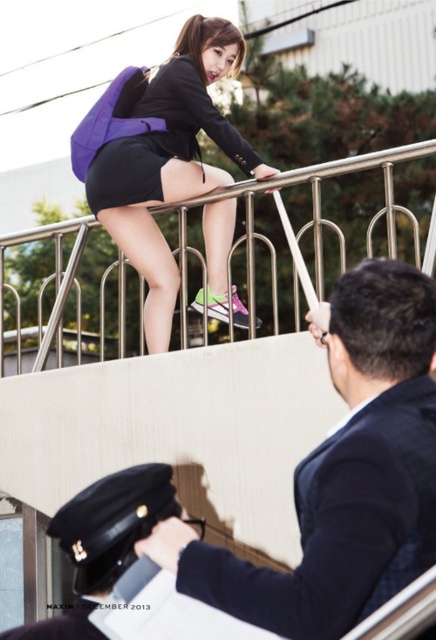
Who is higher up, dark blue suit at upper right or matte purple backpack at upper center?

matte purple backpack at upper center

Which is behind, point (405, 566) or point (116, 243)?

The point (116, 243) is behind.

Identify the location of dark blue suit at upper right. Image resolution: width=436 pixels, height=640 pixels. (344, 474).

Can you confirm if dark blue suit at upper right is taller than matte black blazer at upper center?

Indeed, dark blue suit at upper right has a greater height compared to matte black blazer at upper center.

Is dark blue suit at upper right to the right of matte black blazer at upper center from the viewer's perspective?

Indeed, dark blue suit at upper right is positioned on the right side of matte black blazer at upper center.

Describe the element at coordinates (344, 474) in the screenshot. I see `dark blue suit at upper right` at that location.

This screenshot has height=640, width=436. I want to click on dark blue suit at upper right, so click(344, 474).

Is matte purple backpack at upper center thinner than black leather cap at upper center?

No, matte purple backpack at upper center is not thinner than black leather cap at upper center.

Which is more to the left, matte purple backpack at upper center or black leather cap at upper center?

black leather cap at upper center

Find the location of `matte purple backpack at upper center`. matte purple backpack at upper center is located at coordinates (170, 161).